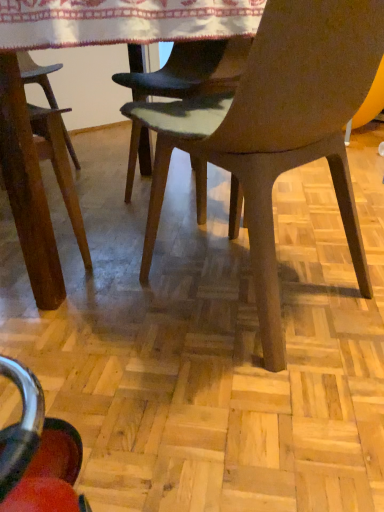
Question: From the image's perspective, is matte brown chair at center above or below white embroidered tablecloth at upper center?

Choices:
 (A) above
 (B) below

Answer: (B)

Question: Would you say matte brown chair at center is inside or outside white embroidered tablecloth at upper center?

Choices:
 (A) outside
 (B) inside

Answer: (A)

Question: Is point (283, 132) closer or farther from the camera than point (44, 44)?

Choices:
 (A) closer
 (B) farther

Answer: (A)

Question: Visually, is white embroidered tablecloth at upper center positioned to the left or to the right of matte brown chair at center?

Choices:
 (A) right
 (B) left

Answer: (B)

Question: From the image's perspective, is white embroidered tablecloth at upper center above or below matte brown chair at center?

Choices:
 (A) above
 (B) below

Answer: (A)

Question: In the image, is white embroidered tablecloth at upper center positioned in front of or behind matte brown chair at center?

Choices:
 (A) front
 (B) behind

Answer: (B)

Question: From a real-world perspective, relative to matte brown chair at center, is white embroidered tablecloth at upper center vertically above or below?

Choices:
 (A) below
 (B) above

Answer: (B)